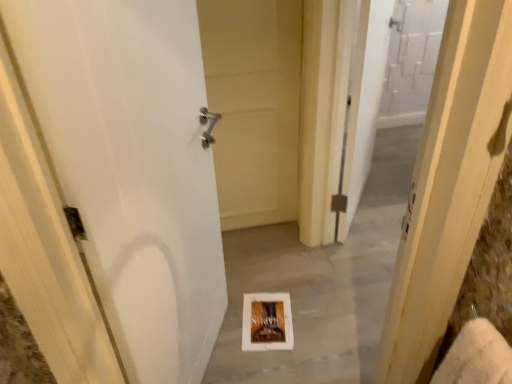
Question: In terms of size, does white matte door at center, the second door from the back, appear bigger or smaller than white paper at center?

Choices:
 (A) small
 (B) big

Answer: (B)

Question: From a real-world perspective, is white matte door at center, the second door from the back, physically located above or below white paper at center?

Choices:
 (A) above
 (B) below

Answer: (A)

Question: Which object is positioned farthest from the white cardboard book at center?

Choices:
 (A) white paper at center
 (B) white matte door at center, the first door in the back-to-front sequence
 (C) white matte door at center, the 1th door in the front-to-back sequence

Answer: (B)

Question: Which object is the closest to the white matte door at center, the second door from the back?

Choices:
 (A) white matte door at center, the first door in the back-to-front sequence
 (B) white cardboard book at center
 (C) white paper at center

Answer: (C)